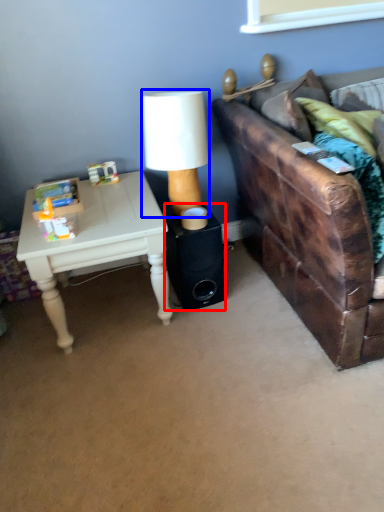
Question: Which object is closer to the camera taking this photo, speaker (highlighted by a red box) or table lamp (highlighted by a blue box)?

Choices:
 (A) speaker
 (B) table lamp

Answer: (B)